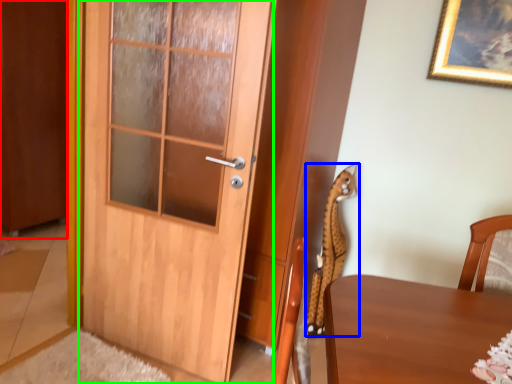
Question: Estimate the real-world distances between objects in this image. Which object is closer to barn door (highlighted by a red box), animal (highlighted by a blue box) or door (highlighted by a green box)?

Choices:
 (A) animal
 (B) door

Answer: (B)